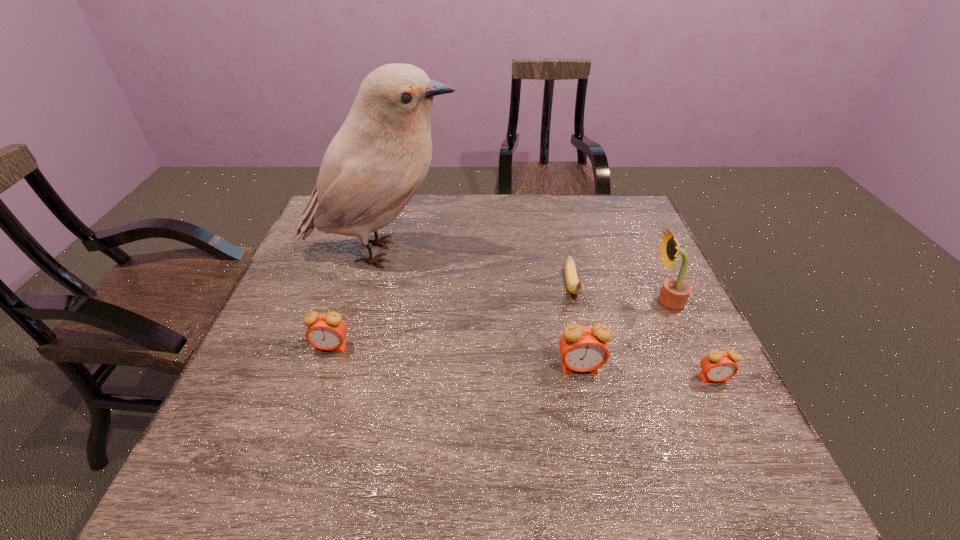
Locate an element on the screen. This screenshot has height=540, width=960. the second tallest alarm clock is located at coordinates (327, 331).

Identify the location of the farthest alarm clock. This screenshot has height=540, width=960. (327, 331).

You are a GUI agent. You are given a task and a screenshot of the screen. Output one action in this format:
    pyautogui.click(x=<x>, y=<y>)
    Task: Click on the tallest alarm clock
    The width and height of the screenshot is (960, 540).
    Given the screenshot: What is the action you would take?
    pyautogui.click(x=583, y=348)

I want to click on the second alarm clock from right to left, so click(x=583, y=348).

Find the location of `the rightmost alarm clock`. the rightmost alarm clock is located at coordinates (718, 365).

Find the location of a particular element. the shortest alarm clock is located at coordinates (718, 365).

The height and width of the screenshot is (540, 960). Identify the location of banana. (575, 286).

This screenshot has height=540, width=960. I want to click on parakeet, so click(376, 162).

This screenshot has height=540, width=960. Find the location of `the second tallest object`. the second tallest object is located at coordinates (675, 291).

You are a GUI agent. You are given a task and a screenshot of the screen. Output one action in this format:
    pyautogui.click(x=<x>, y=<y>)
    Task: Click on the free spot located on the face of the fourth farthest object
    
    Given the screenshot: What is the action you would take?
    pyautogui.click(x=314, y=399)